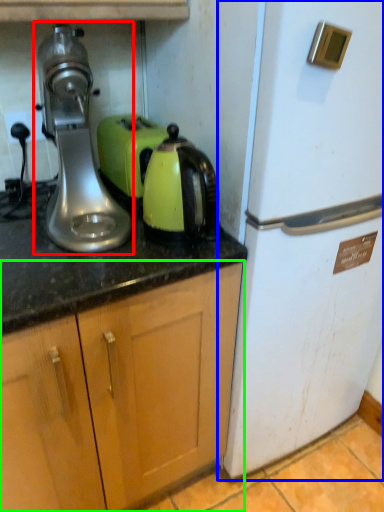
Question: Based on their relative distances, which object is nearer to home appliance (highlighted by a red box)? Choose from refrigerator (highlighted by a blue box) and cabinetry (highlighted by a green box).

Choices:
 (A) refrigerator
 (B) cabinetry

Answer: (B)